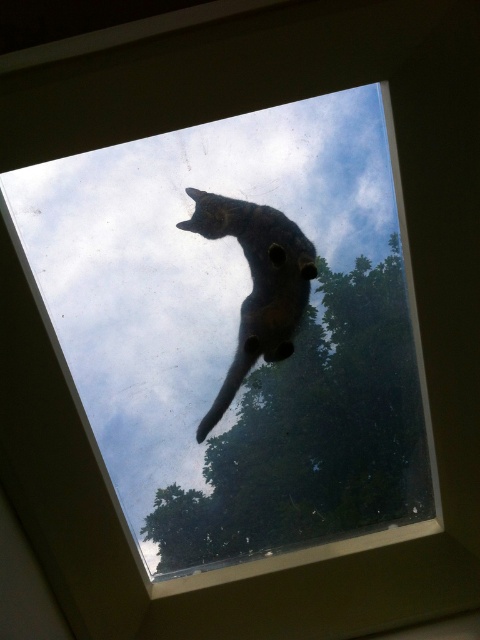
Question: Is green leafy tree at upper center below shiny black cat at upper center?

Choices:
 (A) yes
 (B) no

Answer: (A)

Question: Which point is farther to the camera?

Choices:
 (A) (382, 380)
 (B) (219, 221)

Answer: (A)

Question: Among these objects, which one is nearest to the camera?

Choices:
 (A) green leafy tree at upper center
 (B) shiny black cat at upper center

Answer: (B)

Question: Which object is closer to the camera taking this photo?

Choices:
 (A) green leafy tree at upper center
 (B) shiny black cat at upper center

Answer: (B)

Question: Is green leafy tree at upper center below shiny black cat at upper center?

Choices:
 (A) yes
 (B) no

Answer: (A)

Question: Does green leafy tree at upper center come in front of shiny black cat at upper center?

Choices:
 (A) yes
 (B) no

Answer: (B)